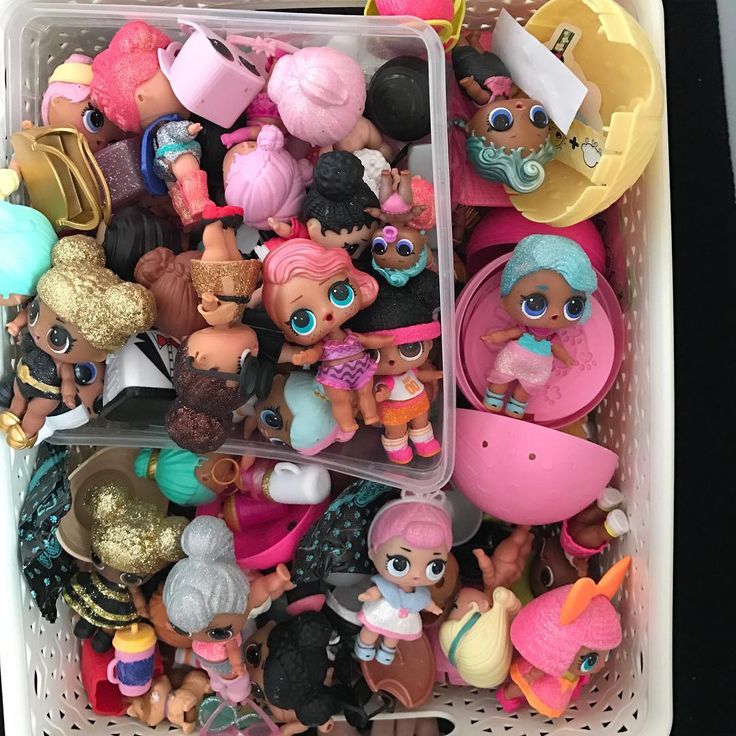
The height and width of the screenshot is (736, 736). In order to click on dolls with pink hair in this screenshot , I will do `click(416, 527)`, `click(566, 640)`, `click(310, 277)`, `click(336, 87)`, `click(247, 177)`, `click(132, 48)`.